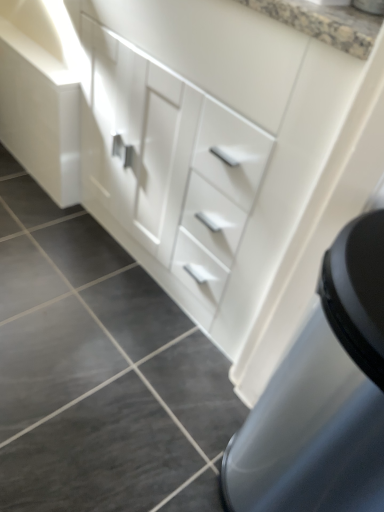
Question: Considering the positions of white glossy drawer at center and dark gray tile at lower left in the image, is white glossy drawer at center bigger or smaller than dark gray tile at lower left?

Choices:
 (A) small
 (B) big

Answer: (B)

Question: Considering the positions of white glossy drawer at center and dark gray tile at lower left in the image, is white glossy drawer at center wider or thinner than dark gray tile at lower left?

Choices:
 (A) wide
 (B) thin

Answer: (A)

Question: Is point (216, 128) positioned closer to the camera than point (130, 381)?

Choices:
 (A) farther
 (B) closer

Answer: (B)

Question: From the image's perspective, relative to white glossy drawer at center, is dark gray tile at lower left above or below?

Choices:
 (A) above
 (B) below

Answer: (B)

Question: Is dark gray tile at lower left taller or shorter than white glossy drawer at center?

Choices:
 (A) short
 (B) tall

Answer: (A)

Question: In terms of width, does dark gray tile at lower left look wider or thinner when compared to white glossy drawer at center?

Choices:
 (A) wide
 (B) thin

Answer: (B)

Question: Is dark gray tile at lower left bigger or smaller than white glossy drawer at center?

Choices:
 (A) big
 (B) small

Answer: (B)